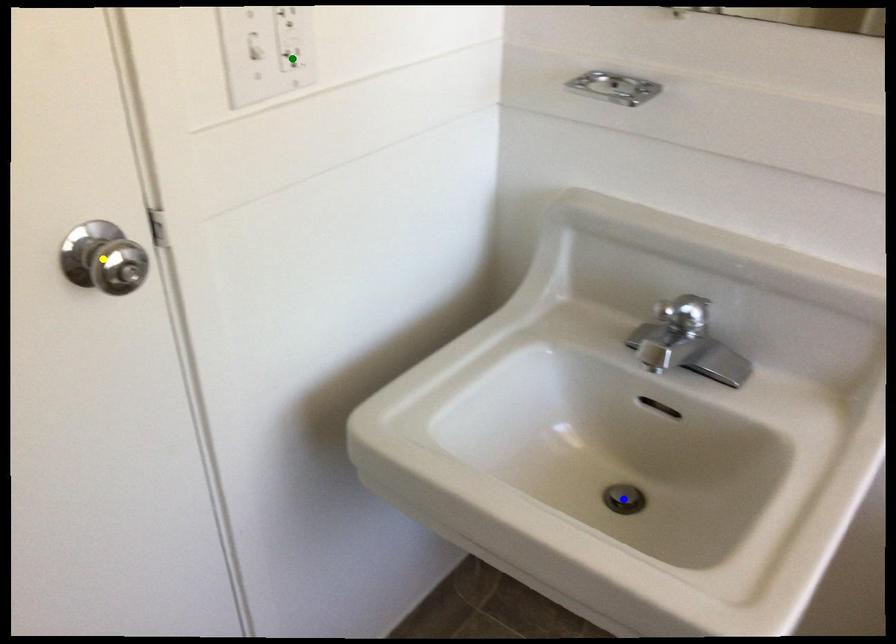
Order these from farthest to nearest:
- yellow point
- green point
- blue point

blue point
green point
yellow point